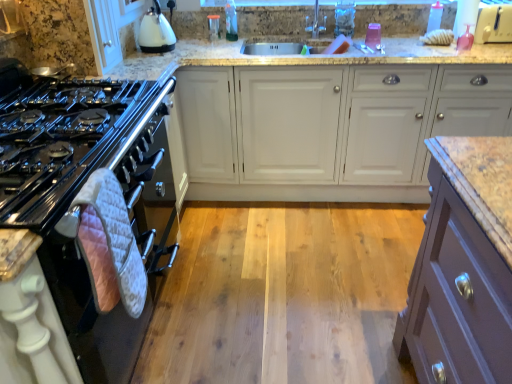
This screenshot has height=384, width=512. Find the location of `white matte cabinet at center`. white matte cabinet at center is located at coordinates (331, 127).

Describe the element at coordinates (494, 24) in the screenshot. The width and height of the screenshot is (512, 384). I see `white plastic toaster at upper right, which is the second appliance in back-to-front order` at that location.

Measure the distance between point (506, 34) and camera.

2.33 meters.

From the picture: What is the approximate height of white quilted oven mitt at left?

white quilted oven mitt at left is 34.41 inches in height.

Identify the location of black glossy gas stove at left. This screenshot has height=384, width=512. (61, 143).

From the image's perspective, which is below, white matte cabinet at center or black glossy gas stove at left?

black glossy gas stove at left appears lower in the image.

You are a GUI agent. You are given a task and a screenshot of the screen. Output one action in this format:
    pyautogui.click(x=<x>, y=<y>)
    Task: Click on the gas stove above the white matte cabinet at center (from a real-world perspective)
    This screenshot has width=512, height=384.
    Given the screenshot: What is the action you would take?
    pyautogui.click(x=61, y=143)

How different are the orientations of white matte cabinet at center and black glossy gas stove at left in degrees?

There is a 89.8-degree angle between the facing directions of white matte cabinet at center and black glossy gas stove at left.

Can you confirm if white quilted oven mitt at left is positioned to the left of clear glass container at upper center, marked as the 2th appliance in a front-to-back arrangement?

Correct, you'll find white quilted oven mitt at left to the left of clear glass container at upper center, marked as the 2th appliance in a front-to-back arrangement.

Considering the sizes of objects white quilted oven mitt at left and clear glass container at upper center, marked as the 2th appliance in a front-to-back arrangement, in the image provided, who is taller, white quilted oven mitt at left or clear glass container at upper center, marked as the 2th appliance in a front-to-back arrangement,?

white quilted oven mitt at left is taller.

Considering the sizes of white quilted oven mitt at left and clear glass container at upper center, marked as the 2th appliance in a front-to-back arrangement, in the image, is white quilted oven mitt at left bigger or smaller than clear glass container at upper center, marked as the 2th appliance in a front-to-back arrangement,?

white quilted oven mitt at left is bigger than clear glass container at upper center, marked as the 2th appliance in a front-to-back arrangement.

Choose the correct answer: Is white quilted oven mitt at left inside clear glass container at upper center, placed as the 1th appliance when sorted from back to front, or outside it?

The correct answer is: outside.

Does point (15, 203) appear closer or farther from the camera than point (348, 120)?

Point (15, 203) is closer to the camera than point (348, 120).

Is black glossy gas stove at left aimed at white matte cabinet at center?

No, black glossy gas stove at left is not aimed at white matte cabinet at center.

From a real-world perspective, who is located lower, black glossy gas stove at left or white matte cabinet at center?

white matte cabinet at center is physically lower.

Which is in front, white plastic toaster at upper right, which is the second appliance in back-to-front order, or clear glass container at upper center, placed as the 1th appliance when sorted from back to front?

white plastic toaster at upper right, which is the second appliance in back-to-front order, is in front.

Can you confirm if white plastic toaster at upper right, the 1th appliance from the right, is thinner than clear glass container at upper center, which ranks as the 1th appliance in left-to-right order?

Incorrect, the width of white plastic toaster at upper right, the 1th appliance from the right, is not less than that of clear glass container at upper center, which ranks as the 1th appliance in left-to-right order.

Is white plastic toaster at upper right, which is the second appliance in back-to-front order, at the left side of clear glass container at upper center, marked as the 2th appliance in a front-to-back arrangement?

No.

Does white matte cabinet at center contain transparent plastic bottle at upper right, the second bottle in the left-to-right sequence?

No, transparent plastic bottle at upper right, the second bottle in the left-to-right sequence, is not surrounded by white matte cabinet at center.

Does white matte cabinet at center appear on the right side of transparent plastic bottle at upper right, the second bottle in the left-to-right sequence?

No.

From a real-world perspective, is white matte cabinet at center beneath transparent plastic bottle at upper right, the first bottle positioned from the right?

Yes.

Is white matte cabinet at center wider or thinner than transparent plastic bottle at upper right, the second bottle in the left-to-right sequence?

Considering their sizes, white matte cabinet at center looks broader than transparent plastic bottle at upper right, the second bottle in the left-to-right sequence.

From the image's perspective, is clear glass container at upper center, which ranks as the 1th appliance in left-to-right order, beneath white quilted oven mitt at left?

Incorrect, from the image's perspective, clear glass container at upper center, which ranks as the 1th appliance in left-to-right order, is higher than white quilted oven mitt at left.

Does point (218, 25) come behind point (28, 145)?

Yes, it is behind point (28, 145).

Is clear glass container at upper center, placed as the 1th appliance when sorted from back to front, turned away from white quilted oven mitt at left?

No, clear glass container at upper center, placed as the 1th appliance when sorted from back to front, is not facing away from white quilted oven mitt at left.

Is the depth of white matte cabinet at center less than that of white quilted oven mitt at left?

No, white matte cabinet at center is further to the viewer.

Which is more to the left, white matte cabinet at center or white quilted oven mitt at left?

From the viewer's perspective, white quilted oven mitt at left appears more on the left side.

Is white matte cabinet at center turned away from white quilted oven mitt at left?

No, white matte cabinet at center's orientation is not away from white quilted oven mitt at left.

How different are the orientations of white matte cabinet at center and white quilted oven mitt at left in degrees?

They differ by 89.8 degrees in their facing directions.

This screenshot has height=384, width=512. Find the location of `gas stove that appears below the white matte cabinet at center (from the image's perspective)`. gas stove that appears below the white matte cabinet at center (from the image's perspective) is located at coordinates (61, 143).

You are a GUI agent. You are given a task and a screenshot of the screen. Output one action in this format:
    pyautogui.click(x=<x>, y=<y>)
    Task: Click on the oven below the clear glass container at upper center, placed as the 1th appliance when sorted from back to front (from a real-world perspective)
    The image size is (512, 384).
    Given the screenshot: What is the action you would take?
    pyautogui.click(x=80, y=222)

Based on their spatial positions, is clear glass container at upper center, placed as the second appliance when sorted from right to left, or white glossy kettle at upper left closer to white quilted oven mitt at left?

white glossy kettle at upper left lies closer to white quilted oven mitt at left than the other object.

Based on their spatial positions, is white matte cabinet at center or clear glass container at upper center, placed as the second appliance when sorted from right to left, closer to white quilted oven mitt at left?

Based on the image, white matte cabinet at center appears to be nearer to white quilted oven mitt at left.

Considering their positions, is transparent plastic bottle at upper right, the second bottle in the left-to-right sequence, positioned further to white plastic toaster at upper right, which is the second appliance in back-to-front order, than black glossy gas stove at left?

The object further to white plastic toaster at upper right, which is the second appliance in back-to-front order, is black glossy gas stove at left.

In the scene shown: Which object lies further to the anchor point white glossy kettle at upper left, translucent plastic bottle at upper center, which appears as the 2th bottle when viewed from the right, or white plastic toaster at upper right, which is the second appliance in back-to-front order?

white plastic toaster at upper right, which is the second appliance in back-to-front order, is positioned further to the anchor white glossy kettle at upper left.

Based on the photo, from the image, which object appears to be farther from white quilted oven mitt at left, white plastic toaster at upper right, which appears as the first appliance when viewed from the front, or black glossy gas stove at left?

white plastic toaster at upper right, which appears as the first appliance when viewed from the front, lies further to white quilted oven mitt at left than the other object.

Looking at the image, which one is located closer to white matte cabinet at center, translucent plastic bottle at upper center, marked as the first bottle in a left-to-right arrangement, or black glossy gas stove at left?

translucent plastic bottle at upper center, marked as the first bottle in a left-to-right arrangement.

Estimate the real-world distances between objects in this image. Which object is closer to white matte cabinet at center, black glossy gas stove at left or transparent plastic bottle at upper right, the second bottle in the left-to-right sequence?

transparent plastic bottle at upper right, the second bottle in the left-to-right sequence.

Based on their spatial positions, is translucent plastic bottle at upper center, marked as the first bottle in a left-to-right arrangement, or white matte cabinet at center closer to black glossy gas stove at left?

Among the two, white matte cabinet at center is located nearer to black glossy gas stove at left.

The height and width of the screenshot is (384, 512). In order to click on bottle positioned between black glossy gas stove at left and translucent plastic bottle at upper center, which appears as the 2th bottle when viewed from the right, from near to far in this screenshot , I will do `click(435, 17)`.

Image resolution: width=512 pixels, height=384 pixels. What are the coordinates of `cabinetry positioned between white quilted oven mitt at left and translucent plastic bottle at upper center, marked as the first bottle in a left-to-right arrangement, from near to far` in the screenshot? It's located at (331, 127).

Find the location of a particular element. bottle situated between clear glass container at upper center, which ranks as the 1th appliance in left-to-right order, and white matte cabinet at center from left to right is located at coordinates (231, 21).

Locate an element on the screen. The height and width of the screenshot is (384, 512). bottle between white quilted oven mitt at left and transparent plastic bottle at upper right, the first bottle positioned from the right, in the horizontal direction is located at coordinates [x=231, y=21].